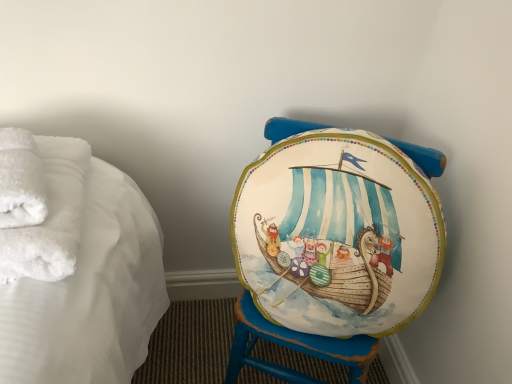
You are a GUI agent. You are given a task and a screenshot of the screen. Output one action in this format:
    pyautogui.click(x=<x>, y=<y>)
    Task: Click on the empty space that is ontop of white fluffy towels at left, the 1th bath towel positioned from the back (from a real-world perspective)
    This screenshot has width=512, height=384.
    Given the screenshot: What is the action you would take?
    pyautogui.click(x=47, y=190)